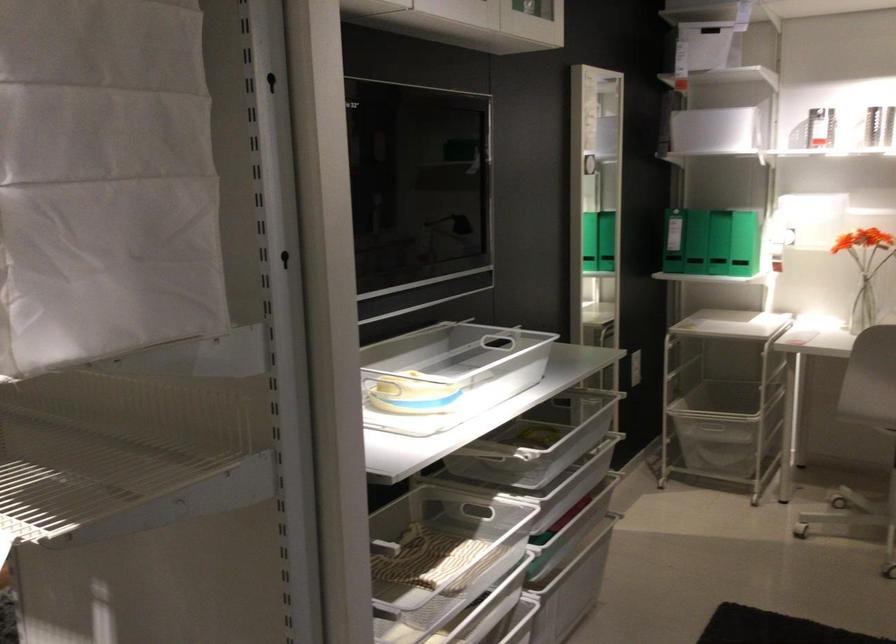
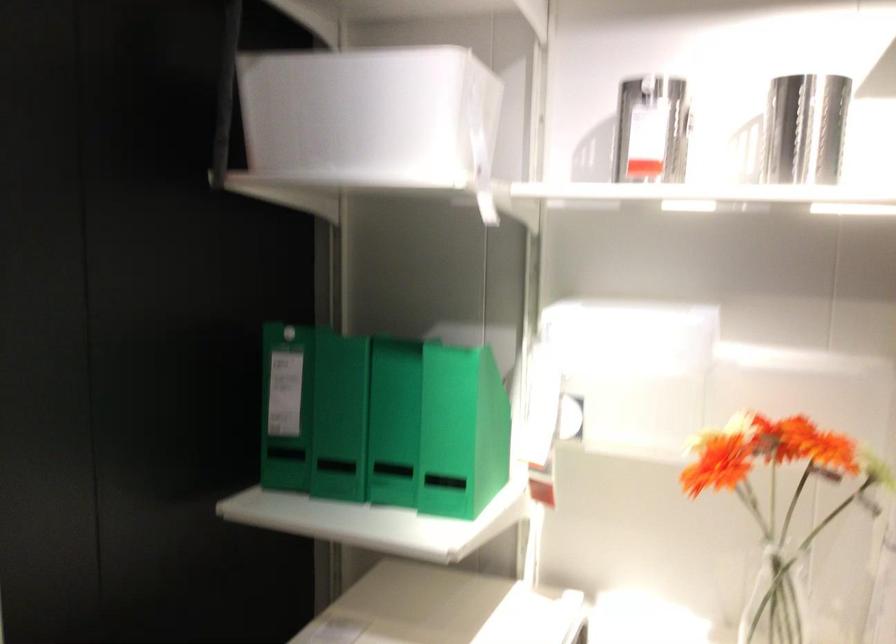
Find the pixel in the second image that matches (x=733, y=113) in the first image.

(373, 118)